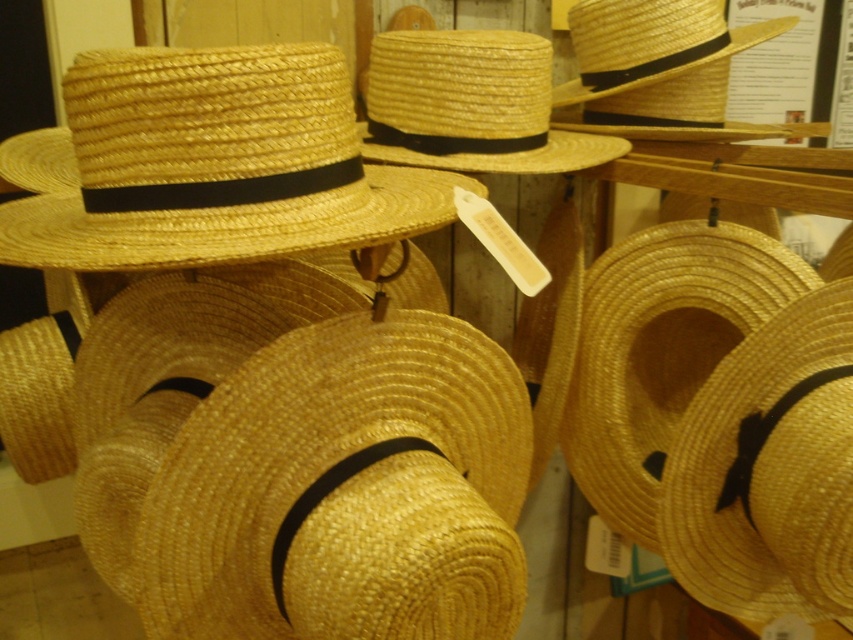
Question: Does woven straw hat at center lie behind natural straw cowboy hat at upper left?

Choices:
 (A) yes
 (B) no

Answer: (A)

Question: Which point is closer to the camera?

Choices:
 (A) (177, 205)
 (B) (367, 68)
 (C) (274, 524)

Answer: (A)

Question: Observing the image, what is the correct spatial positioning of woven straw hat at center in reference to natural straw cowboy hat at center?

Choices:
 (A) above
 (B) below

Answer: (B)

Question: Which point appears farthest from the camera in this image?

Choices:
 (A) (387, 349)
 (B) (474, 67)

Answer: (B)

Question: Is natural straw cowboy hat at upper left bigger than natural straw cowboy hat at center?

Choices:
 (A) no
 (B) yes

Answer: (B)

Question: Estimate the real-world distances between objects in this image. Which object is closer to the natural straw cowboy hat at center?

Choices:
 (A) woven straw hat at center
 (B) natural straw cowboy hat at upper left

Answer: (B)